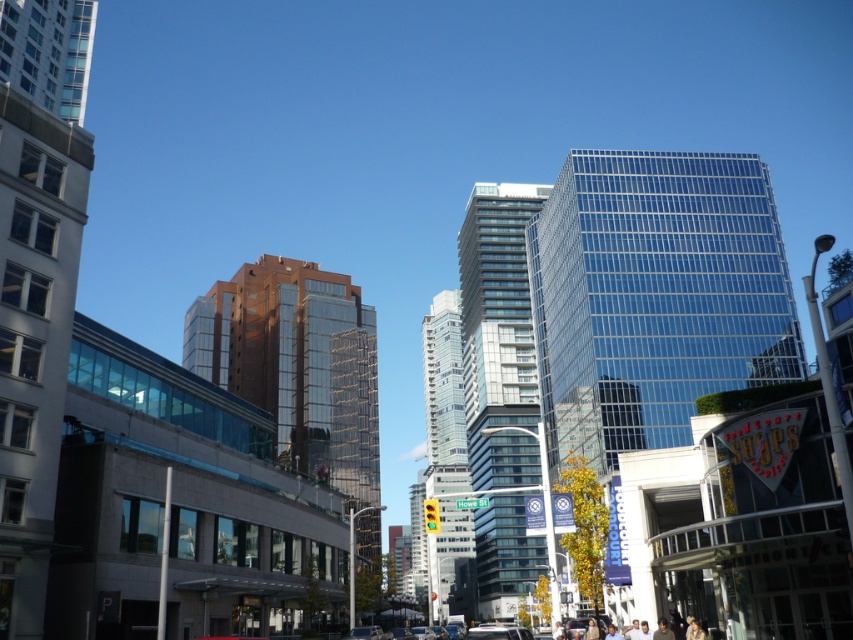
You are a delivery person trying to locate the Food Court Shops sign. You see the transparent glass skyscraper at center and the glassy reflective building at center. Which building is closer to the Food Court Shops sign?

The transparent glass skyscraper at center is positioned on the right side of the glassy reflective building at center. Since the Food Court Shops sign is in the foreground street area, the glassy reflective building at center is closer to the Food Court Shops sign because it is to the left of the transparent glass skyscraper at center, which is further right.

You are standing on the street level looking up at the buildings. Which one is higher up in the sky between the transparent glass skyscraper at center and the glassy reflective building at center?

The transparent glass skyscraper at center is located above the glassy reflective building at center, so it is higher up in the sky.